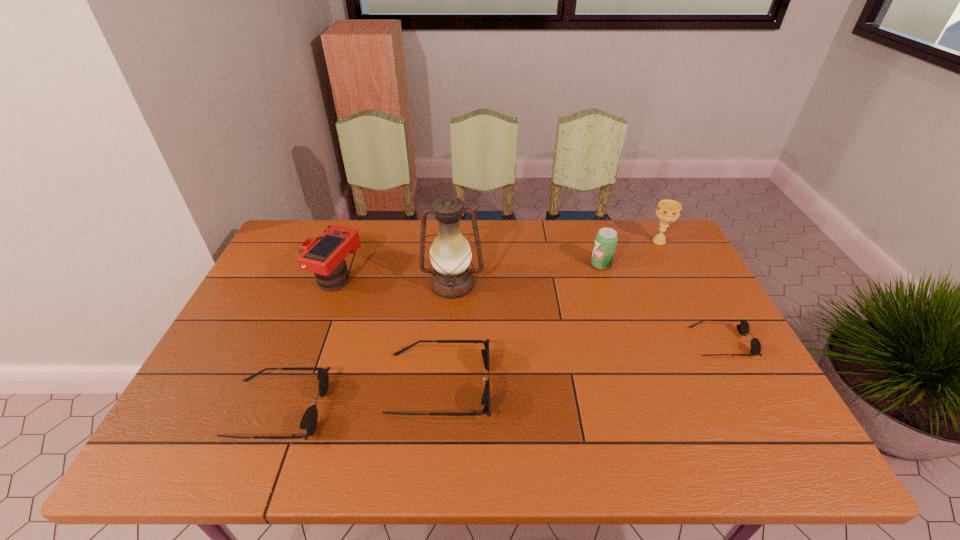
Image resolution: width=960 pixels, height=540 pixels. What are the coordinates of `the second tallest sunglasses` in the screenshot? It's located at (309, 420).

This screenshot has width=960, height=540. Identify the location of the second shortest object. (309, 420).

At what (x,y) coordinates should I click in order to perform the action: click on the second sunglasses from left to right. Please return your answer as a coordinate pair (x, y). Looking at the image, I should click on (485, 401).

This screenshot has width=960, height=540. In order to click on the shortest object in this screenshot , I will do `click(743, 328)`.

Locate an element on the screen. the shortest sunglasses is located at coordinates (743, 328).

Locate an element on the screen. Image resolution: width=960 pixels, height=540 pixels. camera is located at coordinates (324, 256).

In order to click on the tallest object in this screenshot , I will do `click(450, 254)`.

This screenshot has width=960, height=540. Find the location of `the third object from right to left`. the third object from right to left is located at coordinates (606, 239).

Where is `chalice`? chalice is located at coordinates (668, 211).

What are the coordinates of `vacant space located 0.330m on the front-facing side of the second tallest sunglasses` in the screenshot? It's located at (467, 409).